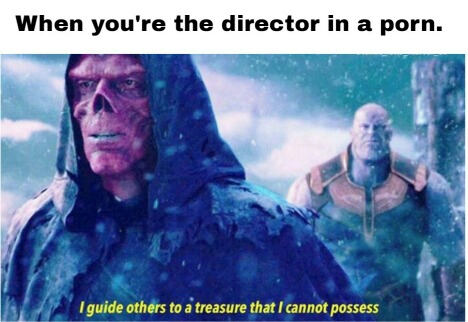
Where is `hood`? hood is located at coordinates (178, 129).